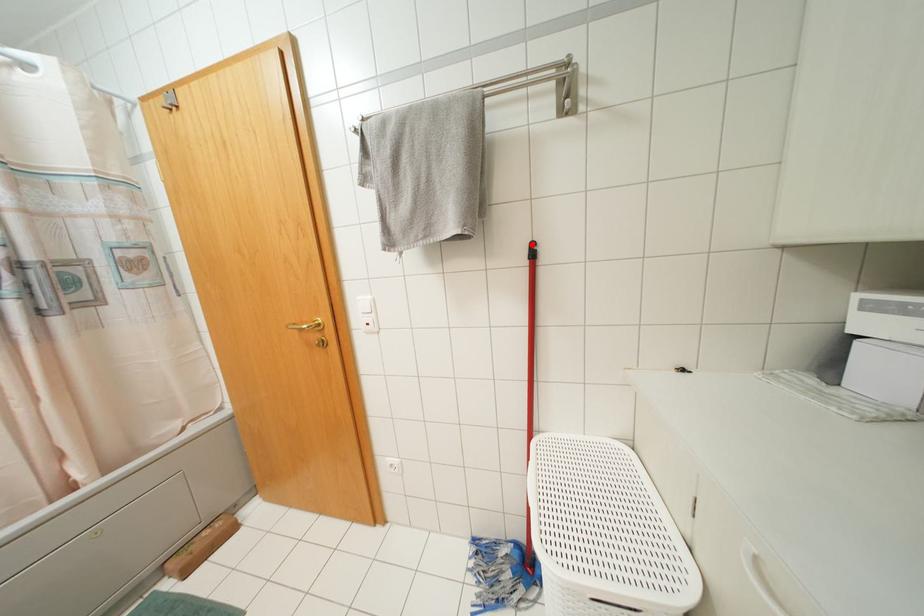
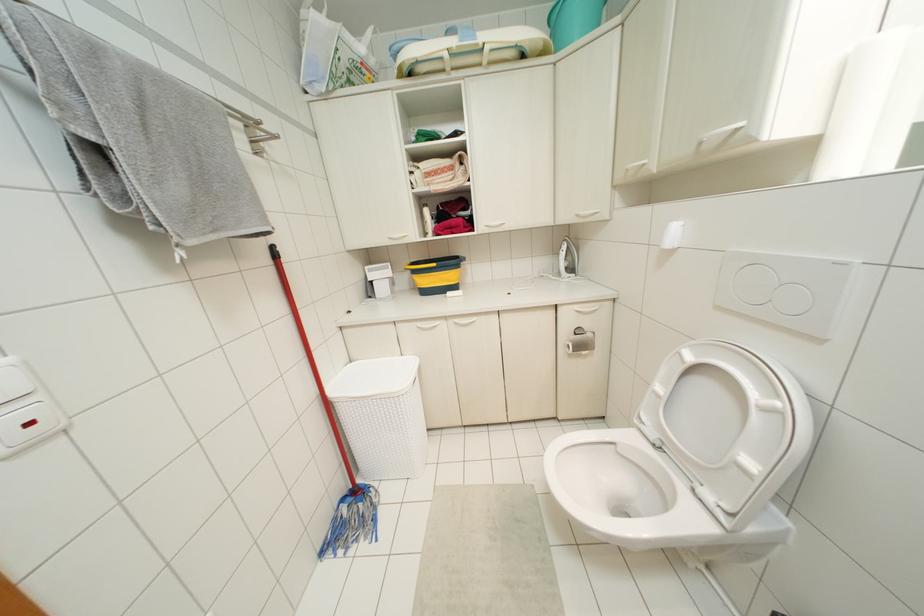
The point at the highlighted location is marked in the first image. Where is the corresponding point in the second image?

(273, 246)